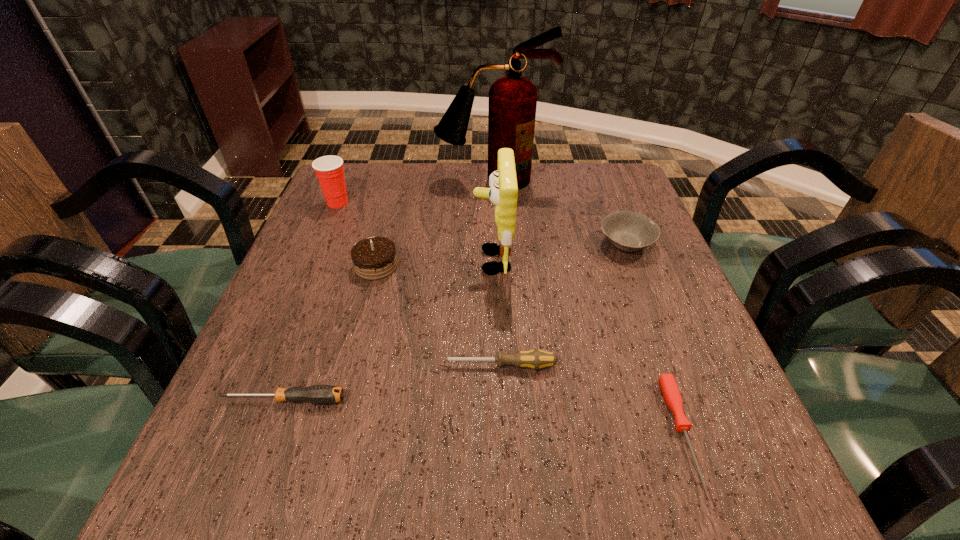
Find the location of a particular element. This screenshot has height=540, width=960. object that stands as the third closest to the tallest object is located at coordinates (329, 169).

The width and height of the screenshot is (960, 540). In order to click on screwdriver identified as the second closest to the farthest screwdriver in this screenshot , I will do pos(671,393).

Select which screwdriver is the second closest to the third nearest object. Please provide its 2D coordinates. Your answer should be formatted as a tuple, i.e. [(x, y)], where the tuple contains the x and y coordinates of a point satisfying the conditions above.

[(671, 393)]